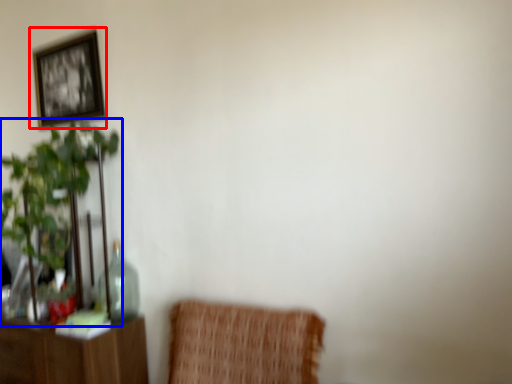
Question: Which object appears closest to the camera in this image, picture frame (highlighted by a red box) or houseplant (highlighted by a blue box)?

Choices:
 (A) picture frame
 (B) houseplant

Answer: (B)